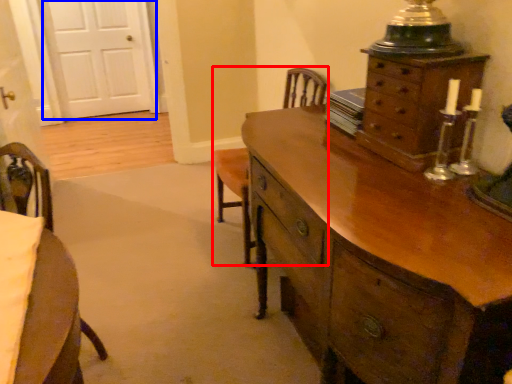
Question: Which object is closer to the camera taking this photo, armchair (highlighted by a red box) or door (highlighted by a blue box)?

Choices:
 (A) armchair
 (B) door

Answer: (A)